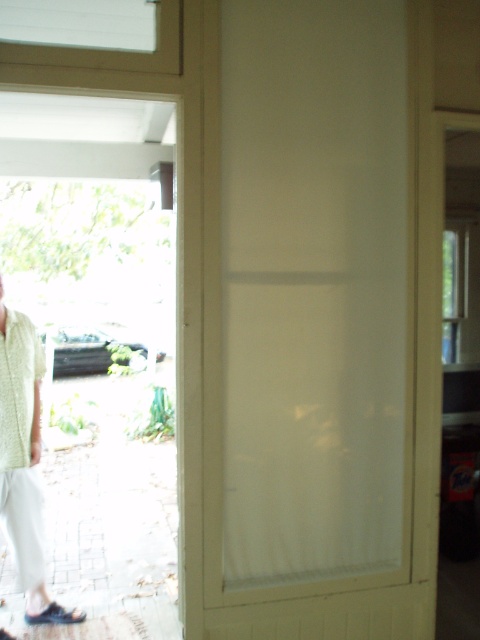
Question: Among these points, which one is farthest from the camera?

Choices:
 (A) (15, 435)
 (B) (312, 467)

Answer: (A)

Question: Is white translucent screen door at center to the right of light green woven shirt at left from the viewer's perspective?

Choices:
 (A) no
 (B) yes

Answer: (B)

Question: Which point is farther from the camera taking this photo?

Choices:
 (A) (43, 362)
 (B) (196, 333)
 (C) (21, 339)

Answer: (A)

Question: Can you confirm if white translucent screen door at center is wider than white knitted shirt at left?

Choices:
 (A) no
 (B) yes

Answer: (B)

Question: Can you confirm if light green woven shirt at left is positioned above white knitted shirt at left?

Choices:
 (A) no
 (B) yes

Answer: (A)

Question: Which point is closer to the camera?

Choices:
 (A) white translucent screen door at center
 (B) white knitted shirt at left

Answer: (A)